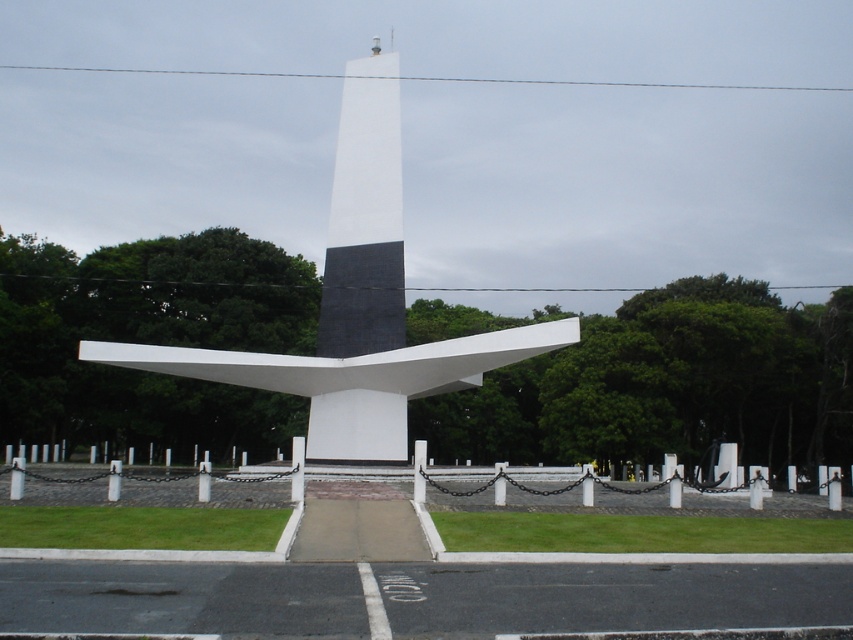
Does point (360, 157) come farther from viewer compared to point (380, 241)?

Yes, point (360, 157) is farther from viewer.

Is white polished stone obelisk at center above white smooth tower at center?

No.

Identify the location of white polished stone obelisk at center. Image resolution: width=853 pixels, height=640 pixels. (357, 305).